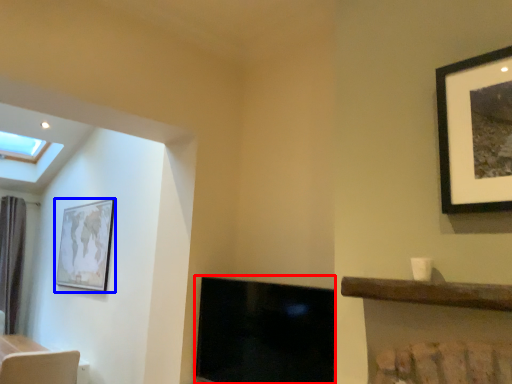
Question: Among these objects, which one is nearest to the camera, fireplace (highlighted by a red box) or picture frame (highlighted by a blue box)?

Choices:
 (A) fireplace
 (B) picture frame

Answer: (A)